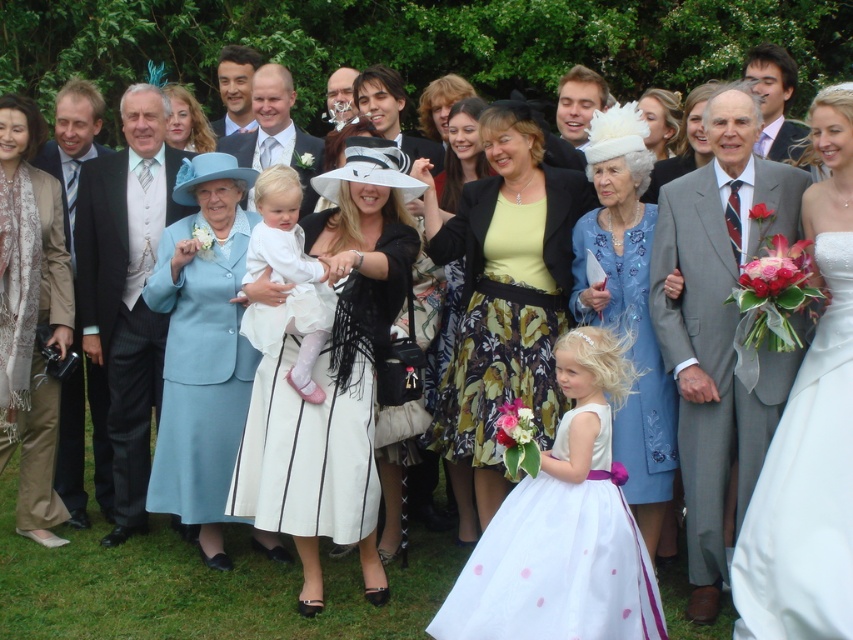
Can you confirm if white satin dress at center is positioned below black pinstripe suit at left?

Correct, white satin dress at center is located below black pinstripe suit at left.

Can you confirm if white satin dress at center is shorter than black pinstripe suit at left?

Yes, white satin dress at center is shorter than black pinstripe suit at left.

Who is more distant from viewer, (602, 627) or (125, 340)?

Point (125, 340)

You are a GUI agent. You are given a task and a screenshot of the screen. Output one action in this format:
    pyautogui.click(x=<x>, y=<y>)
    Task: Click on the white satin dress at center
    The height and width of the screenshot is (640, 853).
    Given the screenshot: What is the action you would take?
    pyautogui.click(x=563, y=528)

Is point (624, 253) behind point (175, 132)?

No.

How distant is blue satin coat at center from matte blue dress at center?

blue satin coat at center and matte blue dress at center are 3.59 meters apart from each other.

Describe the element at coordinates (627, 307) in the screenshot. I see `blue satin coat at center` at that location.

You are a GUI agent. You are given a task and a screenshot of the screen. Output one action in this format:
    pyautogui.click(x=<x>, y=<y>)
    Task: Click on the blue satin coat at center
    Image resolution: width=853 pixels, height=640 pixels.
    Given the screenshot: What is the action you would take?
    pyautogui.click(x=627, y=307)

Can you confirm if white striped dress at center is thinner than light brown suit at left?

In fact, white striped dress at center might be wider than light brown suit at left.

Who is lower down, white striped dress at center or light brown suit at left?

light brown suit at left is below.

Between point (399, 216) and point (64, 403), which one is positioned in front?

Positioned in front is point (399, 216).

Where is `white striped dress at center`? white striped dress at center is located at coordinates pyautogui.click(x=334, y=374).